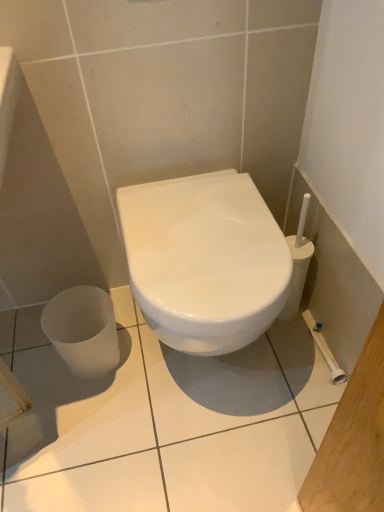
What are the coordinates of `vacant region above white glossy ceramic tile at center (from a real-world perspective)` in the screenshot? It's located at (175, 407).